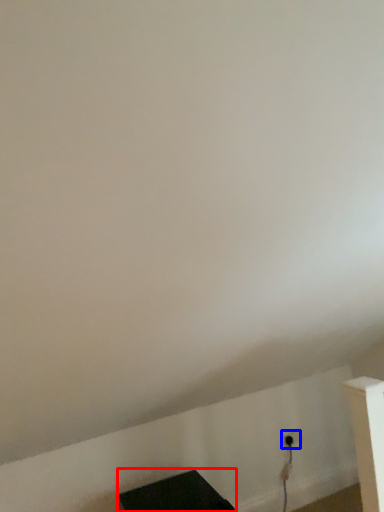
Question: Which point is further to the camera, furniture (highlighted by a red box) or electric outlet (highlighted by a blue box)?

Choices:
 (A) furniture
 (B) electric outlet

Answer: (B)